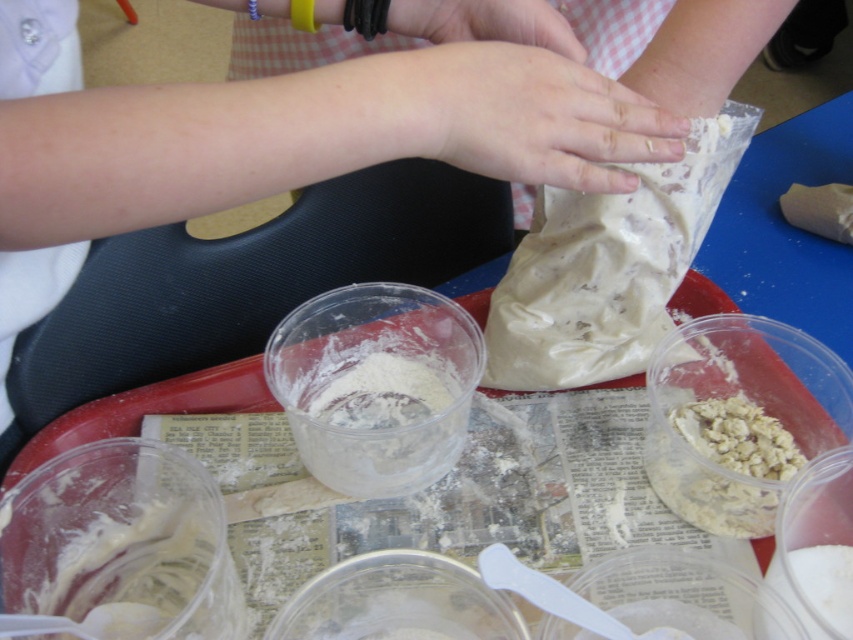
Question: Is clear plastic bowl at center positioned at the back of smooth skin hand at upper center?

Choices:
 (A) no
 (B) yes

Answer: (A)

Question: Which object is farther from the camera taking this photo?

Choices:
 (A) pale skin at center
 (B) smooth beige dough at upper center
 (C) clear plastic bowl at center
 (D) white matte plastic bag at center

Answer: (D)

Question: Can you confirm if white crumbly at center is wider than smooth skin hand at upper center?

Choices:
 (A) yes
 (B) no

Answer: (A)

Question: Considering the real-world distances, which object is closest to the transparent plastic bowl at center?

Choices:
 (A) white crumbly at center
 (B) smooth beige dough at upper center
 (C) pale skin at center
 (D) smooth skin hand at upper center

Answer: (A)

Question: From the image, what is the correct spatial relationship of white matte plastic bag at center in relation to transparent plastic bowl at center?

Choices:
 (A) above
 (B) below

Answer: (A)

Question: Estimate the real-world distances between objects in this image. Which object is closer to the white matte plastic bag at center?

Choices:
 (A) white crumbly at center
 (B) white translucent bowl at center
 (C) smooth beige dough at upper center

Answer: (B)